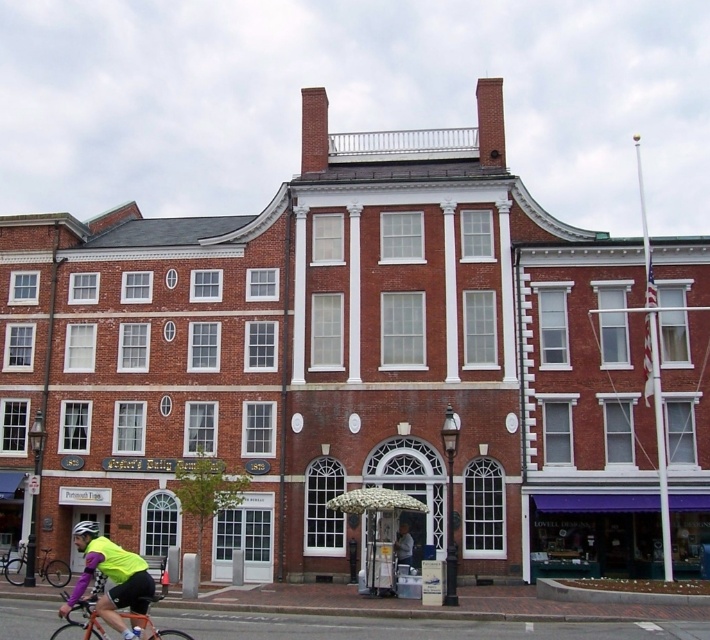
Question: Which of the following is the closest to the observer?

Choices:
 (A) (84, 582)
 (B) (92, 600)

Answer: (B)

Question: Is orange matte bicycle at lower left thinner than black matte bicycle at lower left?

Choices:
 (A) no
 (B) yes

Answer: (A)

Question: Does black matte bicycle at lower left have a smaller size compared to white matte bicycle helmet at center?

Choices:
 (A) yes
 (B) no

Answer: (A)

Question: Which point is farther from the camera taking this photo?

Choices:
 (A) (92, 612)
 (B) (97, 532)

Answer: (B)

Question: Is neon yellow jersey at lower left bigger than black matte bicycle at lower left?

Choices:
 (A) no
 (B) yes

Answer: (B)

Question: Which object appears closest to the camera in this image?

Choices:
 (A) black matte bicycle at lower left
 (B) white matte bicycle helmet at center

Answer: (B)